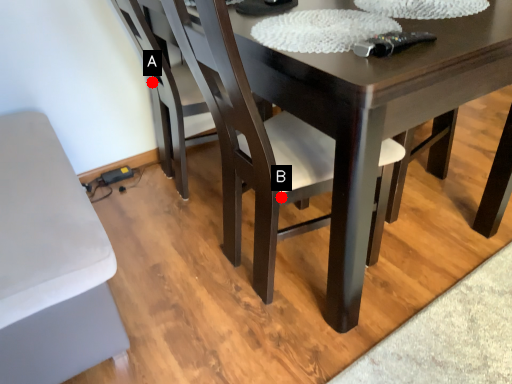
Question: Two points are circled on the image, labeled by A and B beside each circle. Which point is closer to the camera?

Choices:
 (A) A is closer
 (B) B is closer

Answer: (B)